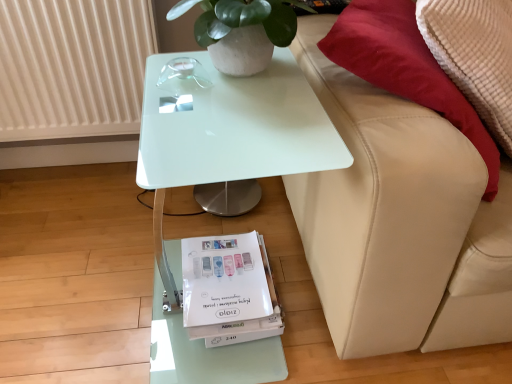
Locate an element on the screen. Image resolution: width=512 pixels, height=384 pixels. free space in front of white matte pot at upper center is located at coordinates (238, 131).